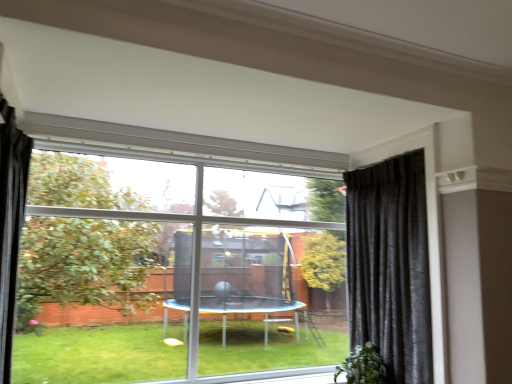
Find the location of `transparent glass window at center`. transparent glass window at center is located at coordinates [x=173, y=267].

Looking at this image, in order to face black velvet curtain at left, placed as the first curtain when sorted from front to back, should I rotate leftwards or rightwards?

It's best to rotate left around 30.729 degrees.

Locate an element on the screen. This screenshot has width=512, height=384. green leafy plant at lower right is located at coordinates (362, 366).

Locate an element on the screen. This screenshot has height=384, width=512. transparent glass window at center is located at coordinates (173, 267).

From a real-world perspective, is green leafy plant at lower right physically below black velvet curtain at right, positioned as the 1th curtain in right-to-left order?

Yes, from a real-world perspective, green leafy plant at lower right is below black velvet curtain at right, positioned as the 1th curtain in right-to-left order.

Considering the positions of objects green leafy plant at lower right and black velvet curtain at right, which is counted as the second curtain, starting from the front, in the image provided, who is more to the left, green leafy plant at lower right or black velvet curtain at right, which is counted as the second curtain, starting from the front,?

green leafy plant at lower right.

Which is correct: green leafy plant at lower right is inside black velvet curtain at right, which is counted as the second curtain, starting from the front, or outside of it?

green leafy plant at lower right is not enclosed by black velvet curtain at right, which is counted as the second curtain, starting from the front.

Are green leafy plant at lower right and black velvet curtain at right, which is counted as the second curtain, starting from the front, making contact?

There is a gap between green leafy plant at lower right and black velvet curtain at right, which is counted as the second curtain, starting from the front.

From a real-world perspective, is black velvet curtain at right, which ranks as the first curtain in back-to-front order, physically above green leafy plant at lower right?

Yes.

Considering the relative sizes of black velvet curtain at right, positioned as the 1th curtain in right-to-left order, and green leafy plant at lower right in the image provided, is black velvet curtain at right, positioned as the 1th curtain in right-to-left order, bigger than green leafy plant at lower right?

Yes.

At what (x,y) coordinates should I click in order to perform the action: click on the 1st curtain in front of the green leafy plant at lower right, counting from the anchor's position. Please return your answer as a coordinate pair (x, y). This screenshot has height=384, width=512. Looking at the image, I should click on (390, 265).

Measure the distance from transparent glass window at center to black velvet curtain at left, which appears as the 2th curtain when viewed from the right.

transparent glass window at center and black velvet curtain at left, which appears as the 2th curtain when viewed from the right, are 7.31 feet apart from each other.

Consider the image. Are transparent glass window at center and black velvet curtain at left, positioned as the 1th curtain in left-to-right order, located far from each other?

Yes, transparent glass window at center and black velvet curtain at left, positioned as the 1th curtain in left-to-right order, are quite far apart.

Who is smaller, transparent glass window at center or black velvet curtain at left, which appears as the 2th curtain when viewed from the right?

black velvet curtain at left, which appears as the 2th curtain when viewed from the right, is smaller.

This screenshot has width=512, height=384. Find the location of `window on the right side of black velvet curtain at left, placed as the first curtain when sorted from front to back`. window on the right side of black velvet curtain at left, placed as the first curtain when sorted from front to back is located at coordinates (173, 267).

Does black velvet curtain at right, which is counted as the second curtain, starting from the front, turn towards black velvet curtain at left, placed as the 2th curtain when sorted from back to front?

Yes, black velvet curtain at right, which is counted as the second curtain, starting from the front, is oriented towards black velvet curtain at left, placed as the 2th curtain when sorted from back to front.

Is point (374, 193) less distant than point (16, 213)?

No.

In the scene shown: Considering the relative positions of black velvet curtain at right, positioned as the 1th curtain in right-to-left order, and black velvet curtain at left, placed as the first curtain when sorted from front to back, in the image provided, is black velvet curtain at right, positioned as the 1th curtain in right-to-left order, to the left of black velvet curtain at left, placed as the first curtain when sorted from front to back, from the viewer's perspective?

In fact, black velvet curtain at right, positioned as the 1th curtain in right-to-left order, is to the right of black velvet curtain at left, placed as the first curtain when sorted from front to back.

Consider the image. Is black velvet curtain at right, which ranks as the first curtain in back-to-front order, next to black velvet curtain at left, placed as the 2th curtain when sorted from back to front, and touching it?

No, black velvet curtain at right, which ranks as the first curtain in back-to-front order, is not touching black velvet curtain at left, placed as the 2th curtain when sorted from back to front.

Visually, is black velvet curtain at left, placed as the 2th curtain when sorted from back to front, positioned to the left or to the right of transparent glass window at center?

Clearly, black velvet curtain at left, placed as the 2th curtain when sorted from back to front, is on the left of transparent glass window at center in the image.

Between black velvet curtain at left, which appears as the 2th curtain when viewed from the right, and transparent glass window at center, which one has more height?

Standing taller between the two is transparent glass window at center.

Considering the relative sizes of transparent glass window at center and green leafy plant at lower right in the image provided, is transparent glass window at center bigger than green leafy plant at lower right?

Yes, transparent glass window at center is bigger than green leafy plant at lower right.

Does transparent glass window at center touch green leafy plant at lower right?

There is a gap between transparent glass window at center and green leafy plant at lower right.

What's the angular difference between transparent glass window at center and green leafy plant at lower right's facing directions?

transparent glass window at center and green leafy plant at lower right are facing 90 degrees away from each other.

Which of these two, transparent glass window at center or green leafy plant at lower right, is thinner?

Thinner between the two is transparent glass window at center.

Can you confirm if transparent glass window at center is thinner than black velvet curtain at right, which ranks as the first curtain in back-to-front order?

Yes.

From the image's perspective, which one is positioned higher, transparent glass window at center or black velvet curtain at right, positioned as the 1th curtain in right-to-left order?

transparent glass window at center appears higher in the image.

Considering the positions of objects transparent glass window at center and black velvet curtain at right, which is counted as the second curtain, starting from the front, in the image provided, who is in front, transparent glass window at center or black velvet curtain at right, which is counted as the second curtain, starting from the front,?

black velvet curtain at right, which is counted as the second curtain, starting from the front.

Is transparent glass window at center in contact with black velvet curtain at right, which ranks as the first curtain in back-to-front order?

No, transparent glass window at center is not beside black velvet curtain at right, which ranks as the first curtain in back-to-front order.

I want to click on the 1st curtain located above the green leafy plant at lower right (from a real-world perspective), so click(x=390, y=265).

Image resolution: width=512 pixels, height=384 pixels. Find the location of `plant on the left of black velvet curtain at right, positioned as the 1th curtain in right-to-left order`. plant on the left of black velvet curtain at right, positioned as the 1th curtain in right-to-left order is located at coordinates (362, 366).

Estimate the real-world distances between objects in this image. Which object is closer to black velvet curtain at right, which is counted as the second curtain, starting from the front, green leafy plant at lower right or black velvet curtain at left, placed as the first curtain when sorted from front to back?

green leafy plant at lower right is closer to black velvet curtain at right, which is counted as the second curtain, starting from the front.

When comparing their distances from transparent glass window at center, does green leafy plant at lower right or black velvet curtain at right, acting as the 2th curtain starting from the left, seem closer?

Among the two, black velvet curtain at right, acting as the 2th curtain starting from the left, is located nearer to transparent glass window at center.

From the image, which object appears to be nearer to black velvet curtain at left, placed as the 2th curtain when sorted from back to front, transparent glass window at center or green leafy plant at lower right?

Based on the image, transparent glass window at center appears to be nearer to black velvet curtain at left, placed as the 2th curtain when sorted from back to front.

From the image, which object appears to be nearer to green leafy plant at lower right, black velvet curtain at left, placed as the first curtain when sorted from front to back, or transparent glass window at center?

The object closer to green leafy plant at lower right is transparent glass window at center.

Which object lies further to the anchor point transparent glass window at center, green leafy plant at lower right or black velvet curtain at left, placed as the 2th curtain when sorted from back to front?

Among the two, black velvet curtain at left, placed as the 2th curtain when sorted from back to front, is located further to transparent glass window at center.

Based on their spatial positions, is transparent glass window at center or black velvet curtain at left, which appears as the 2th curtain when viewed from the right, closer to black velvet curtain at right, positioned as the 1th curtain in right-to-left order?

transparent glass window at center lies closer to black velvet curtain at right, positioned as the 1th curtain in right-to-left order, than the other object.

From the image, which object appears to be farther from black velvet curtain at right, which ranks as the first curtain in back-to-front order, black velvet curtain at left, placed as the first curtain when sorted from front to back, or transparent glass window at center?

black velvet curtain at left, placed as the first curtain when sorted from front to back.

When comparing their distances from black velvet curtain at left, placed as the 2th curtain when sorted from back to front, does black velvet curtain at right, which ranks as the first curtain in back-to-front order, or green leafy plant at lower right seem further?

Among the two, black velvet curtain at right, which ranks as the first curtain in back-to-front order, is located further to black velvet curtain at left, placed as the 2th curtain when sorted from back to front.

You are a GUI agent. You are given a task and a screenshot of the screen. Output one action in this format:
    pyautogui.click(x=<x>, y=<y>)
    Task: Click on the plant between transparent glass window at center and black velvet curtain at right, which ranks as the first curtain in back-to-front order, from left to right
    
    Given the screenshot: What is the action you would take?
    pyautogui.click(x=362, y=366)

You are a GUI agent. You are given a task and a screenshot of the screen. Output one action in this format:
    pyautogui.click(x=<x>, y=<y>)
    Task: Click on the window located between black velvet curtain at left, which appears as the 2th curtain when viewed from the right, and green leafy plant at lower right in the left-right direction
    Image resolution: width=512 pixels, height=384 pixels.
    Given the screenshot: What is the action you would take?
    pyautogui.click(x=173, y=267)

Locate an element on the screen. This screenshot has width=512, height=384. plant between black velvet curtain at left, placed as the 2th curtain when sorted from back to front, and black velvet curtain at right, acting as the 2th curtain starting from the left, from left to right is located at coordinates (362, 366).

The image size is (512, 384). In order to click on window between black velvet curtain at left, positioned as the 1th curtain in left-to-right order, and black velvet curtain at right, which ranks as the first curtain in back-to-front order, in the horizontal direction in this screenshot , I will do `click(173, 267)`.